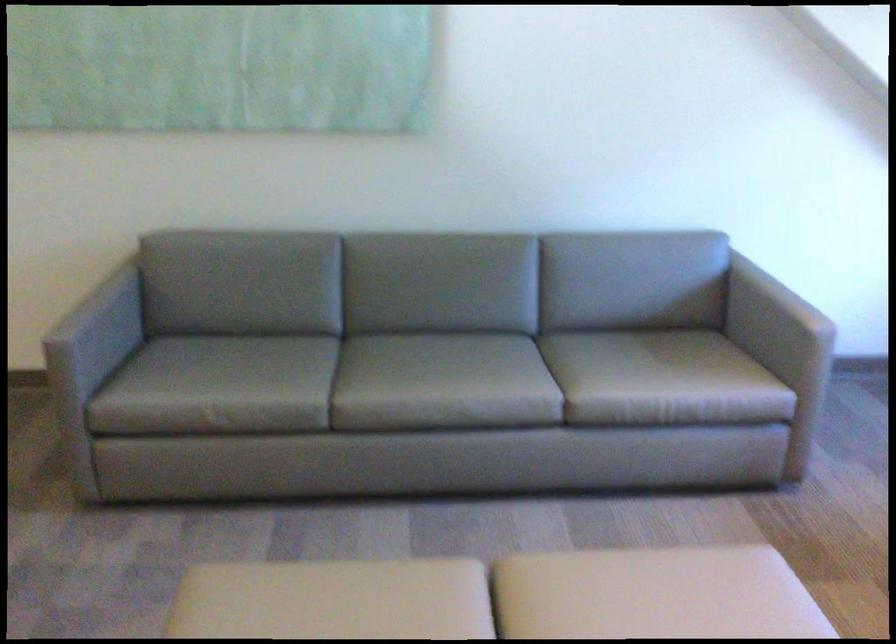
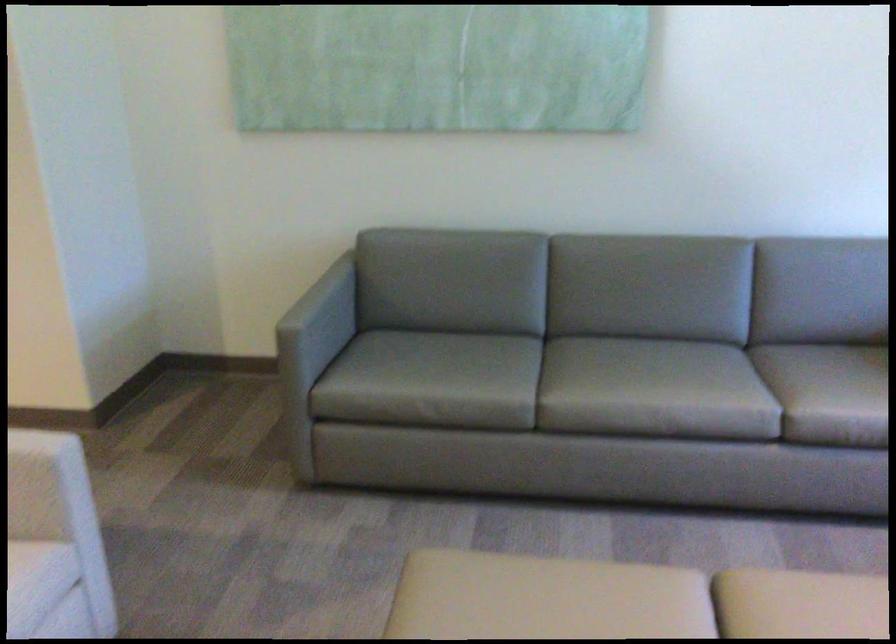
Locate, in the second image, the point that corresponds to pixel 98 322 in the first image.

(321, 313)